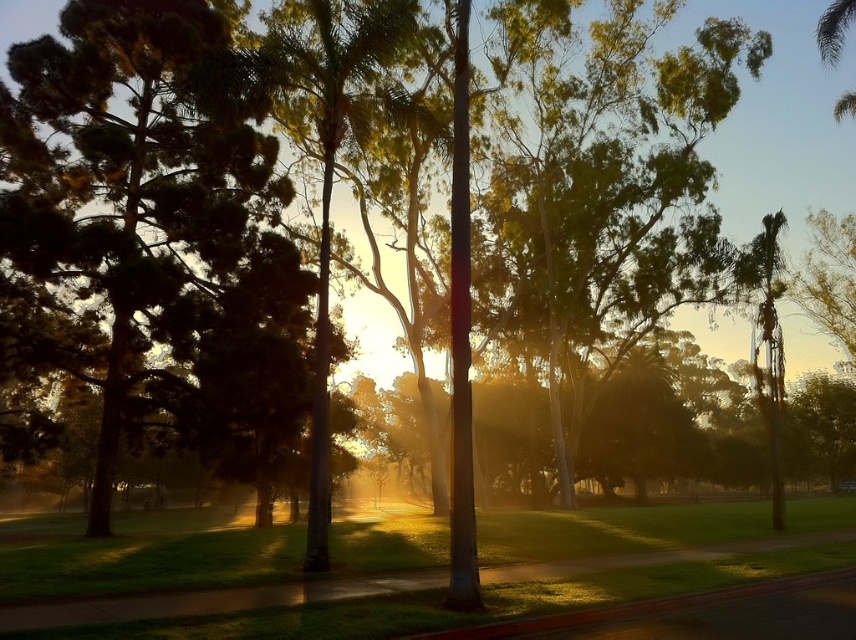
Question: Which point is farther from the camera taking this photo?

Choices:
 (A) (758, 305)
 (B) (321, 330)

Answer: (A)

Question: Is green leafy palm tree at center smaller than green leafy palm tree at right?

Choices:
 (A) no
 (B) yes

Answer: (B)

Question: Which point appears closest to the camera in this image?

Choices:
 (A) (334, 122)
 (B) (776, 452)

Answer: (A)

Question: Does green leafy palm tree at center appear on the right side of green leafy palm tree at right?

Choices:
 (A) no
 (B) yes

Answer: (A)

Question: Which of the following is the farthest from the observer?

Choices:
 (A) (417, 100)
 (B) (771, 420)

Answer: (A)

Question: Is green leafy palm tree at center wider than green leafy palm tree at right?

Choices:
 (A) no
 (B) yes

Answer: (A)